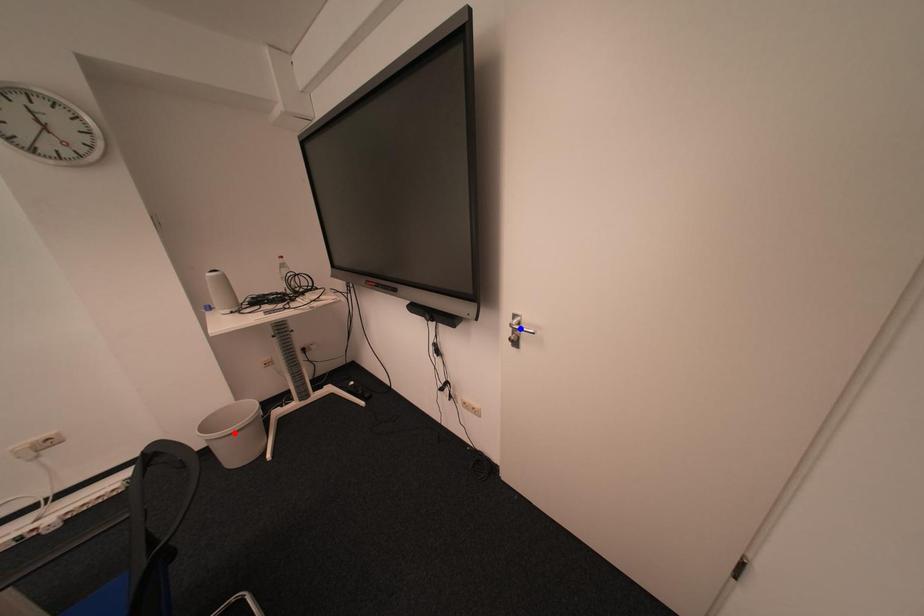
Question: In the image, two points are highlighted. Which point is nearer to the camera? Reply with the corresponding letter.

Choices:
 (A) blue point
 (B) red point

Answer: (A)